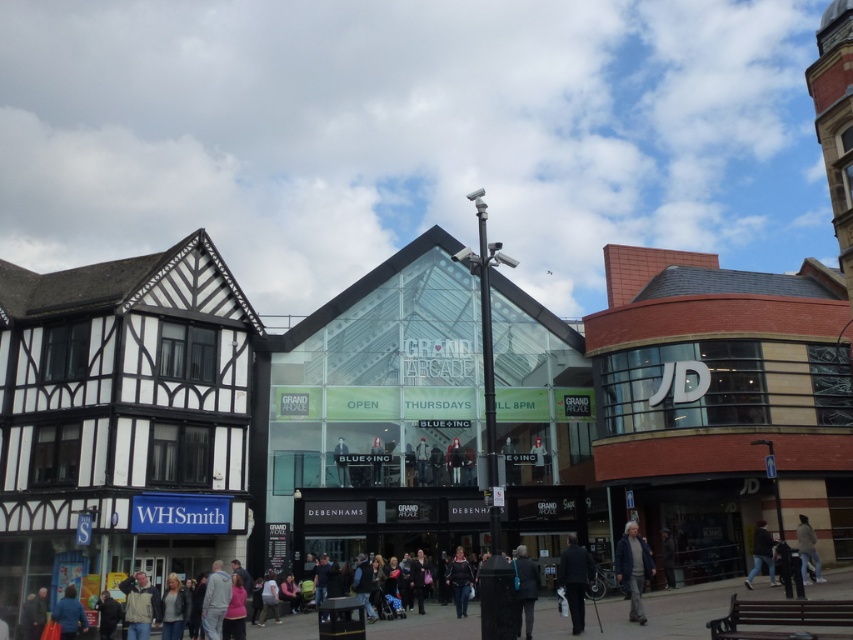
Question: Where is light gray fabric jacket at center located in relation to dark gray sweater at center in the image?

Choices:
 (A) below
 (B) above

Answer: (B)

Question: Which point is farther to the camera?

Choices:
 (A) (769, 550)
 (B) (572, 534)

Answer: (B)

Question: Which point appears farthest from the camera in this image?

Choices:
 (A) (805, 524)
 (B) (575, 556)
 (C) (225, 600)
 (D) (749, 572)

Answer: (D)

Question: Is dark gray sweater at center below dark blue jeans at lower right?

Choices:
 (A) no
 (B) yes

Answer: (B)

Question: Can you confirm if blue denim jacket at lower right is positioned to the right of dark blue fabric jacket at lower center?

Choices:
 (A) yes
 (B) no

Answer: (A)

Question: Which of these objects is positioned closest to the dark blue jeans at lower right?

Choices:
 (A) dark gray sweater at center
 (B) blue denim jacket at lower right
 (C) smooth black jacket at center
 (D) dark blue fabric jacket at lower center

Answer: (B)